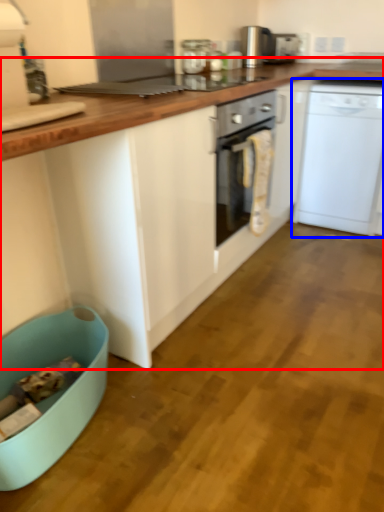
Question: Which point is further to the camera, cabinetry (highlighted by a red box) or home appliance (highlighted by a blue box)?

Choices:
 (A) cabinetry
 (B) home appliance

Answer: (B)